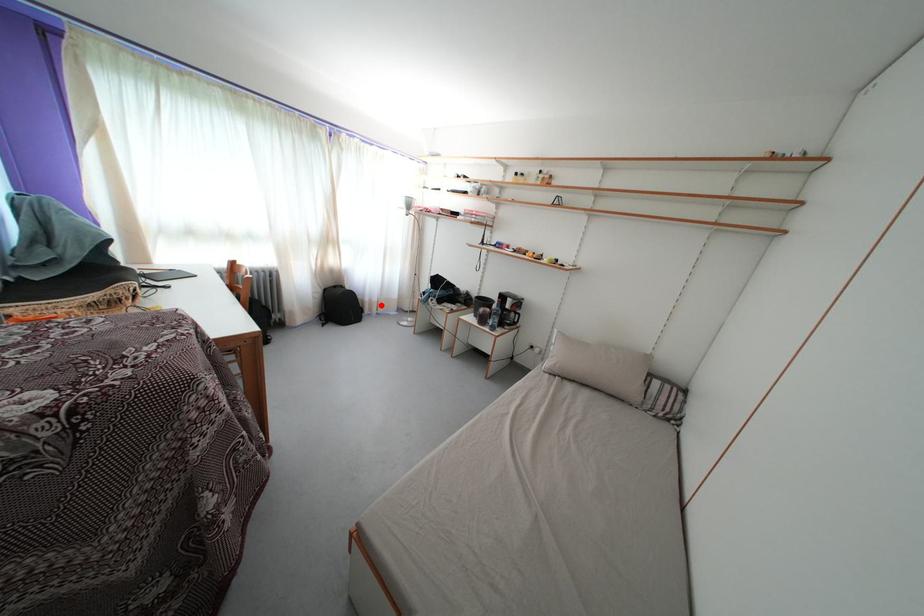
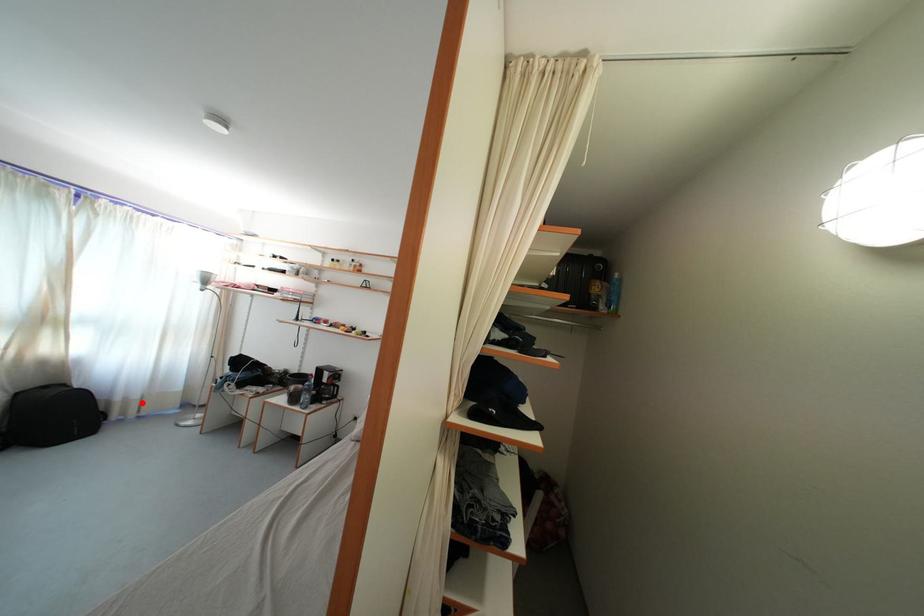
I am providing you with two images of the same scene from different viewpoints. A red point is marked on the first image and another point is marked on the second image. Are the points marked in image1 and image2 representing the same 3D position?

Yes